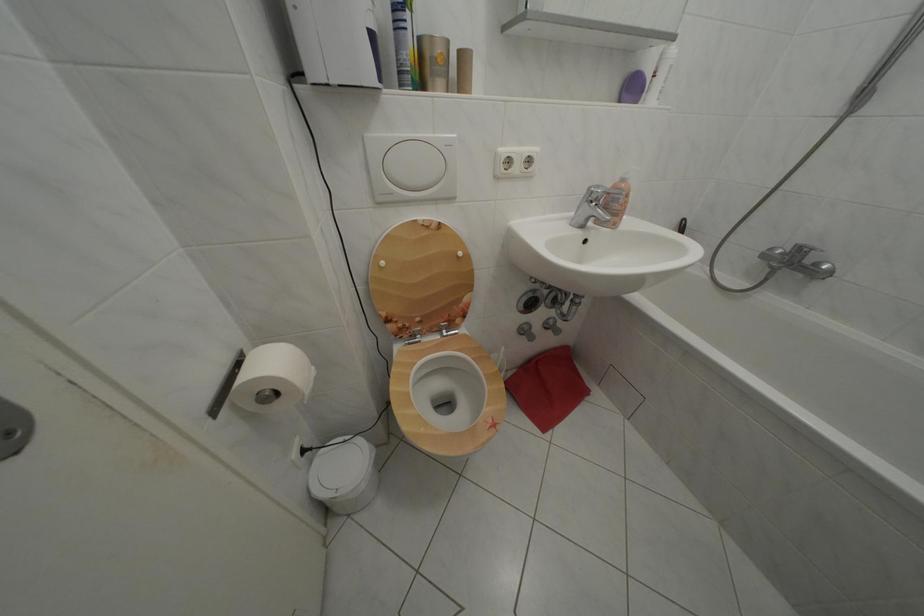
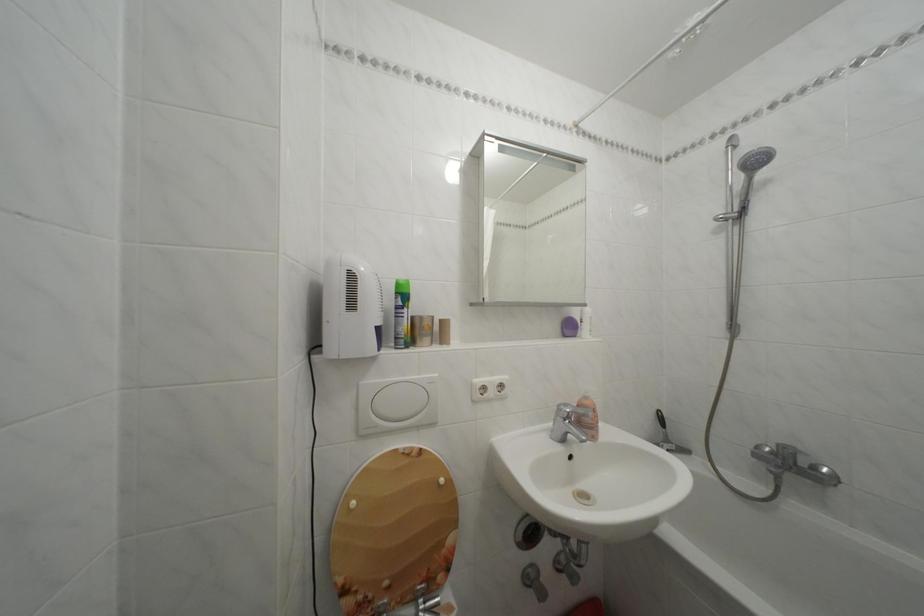
Question: The first image is from the beginning of the video and the second image is from the end. How did the camera likely rotate when shooting the video?

Choices:
 (A) Left
 (B) Right
 (C) Up
 (D) Down

Answer: (C)